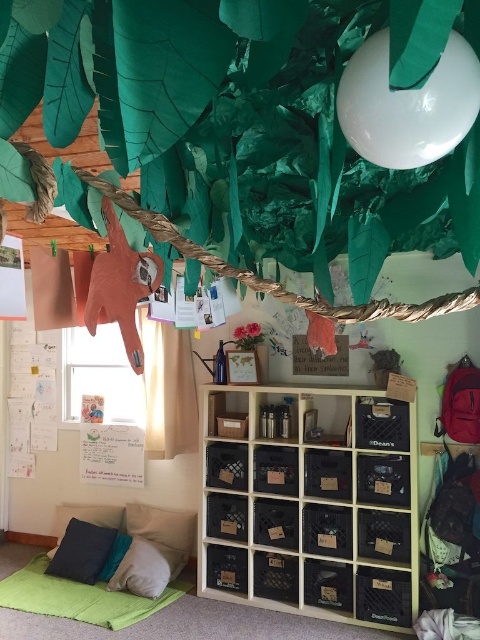
Question: Which point appears farthest from the camera in this image?

Choices:
 (A) (121, 579)
 (B) (88, 560)
 (C) (51, 554)
 (D) (348, 456)

Answer: (C)

Question: Which is farther from the teal fabric pillow at lower left?

Choices:
 (A) dark gray cushion at lower left
 (B) velvety blue pillow at lower left
 (C) black plastic crate at center

Answer: (C)

Question: Is the position of black plastic crate at center more distant than that of dark gray cushion at lower left?

Choices:
 (A) yes
 (B) no

Answer: (B)

Question: Can you confirm if black plastic crate at center is positioned to the left of velvety blue pillow at lower left?

Choices:
 (A) no
 (B) yes

Answer: (A)

Question: Does white soft pillow at lower left lie behind velvety blue pillow at lower left?

Choices:
 (A) no
 (B) yes

Answer: (A)

Question: Which point is farther to the camera?

Choices:
 (A) velvety blue pillow at lower left
 (B) white soft pillow at lower left

Answer: (A)